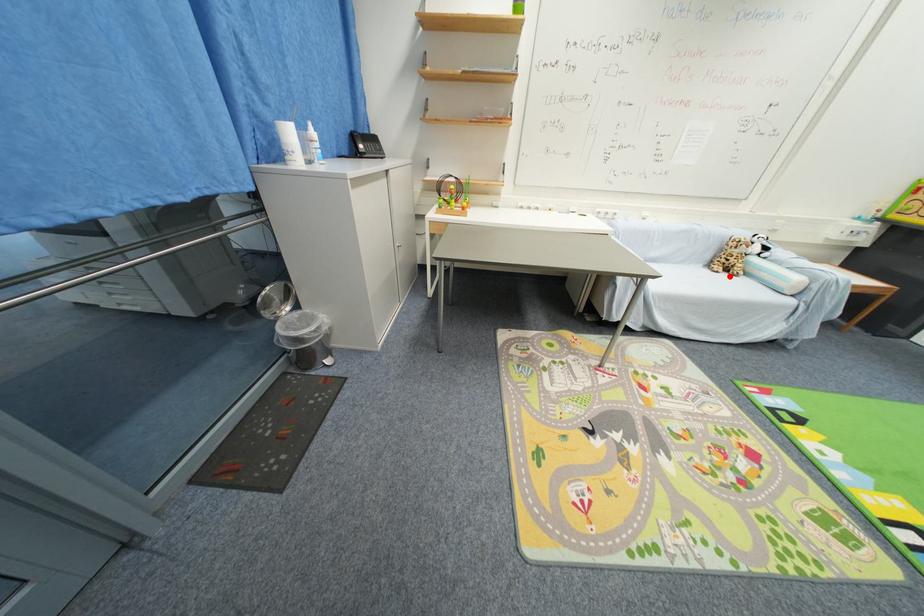
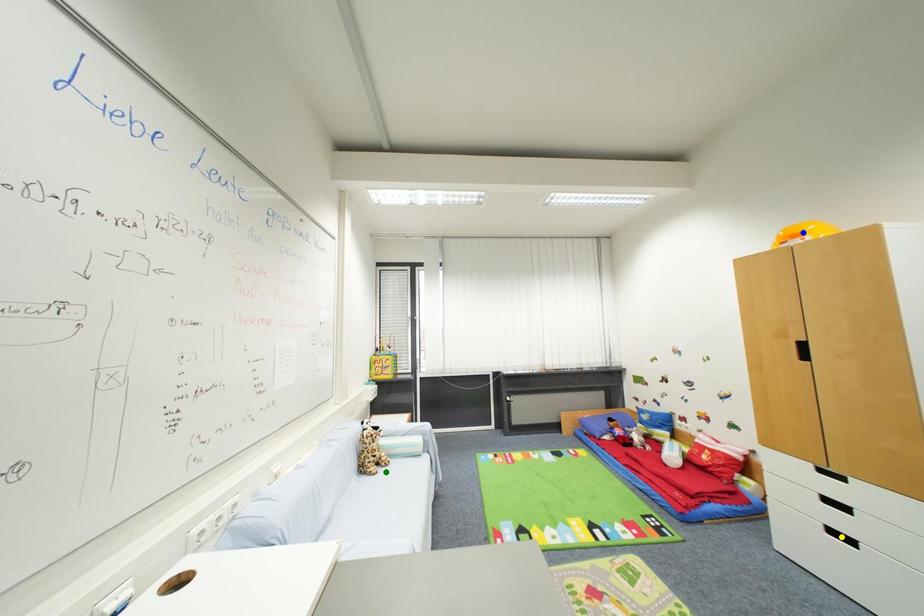
Question: I am providing you with two images of the same scene from different viewpoints. A red point is marked on the first image. You are given multiple points on the second image. Which mark in image 2 goes with the point in image 1?

Choices:
 (A) green point
 (B) blue point
 (C) yellow point

Answer: (A)